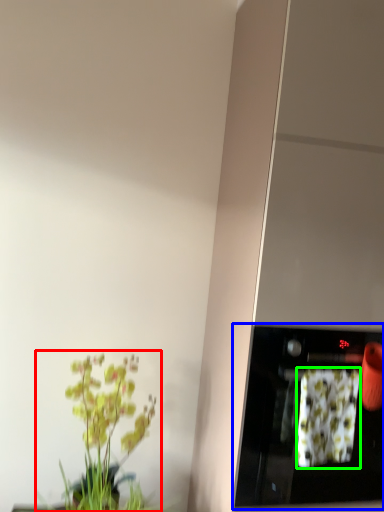
Question: Which object is the closest to the houseplant (highlighted by a red box)? Choose among these: appliance (highlighted by a blue box) or flower (highlighted by a green box).

Choices:
 (A) appliance
 (B) flower

Answer: (A)